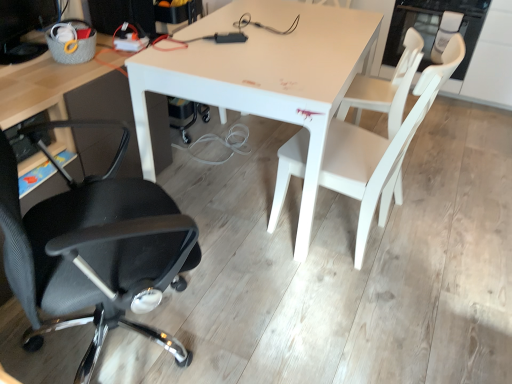
Find the location of a particular element. This screenshot has width=512, height=384. spots to the right of white matte chair at right, acting as the third chair starting from the left is located at coordinates (438, 182).